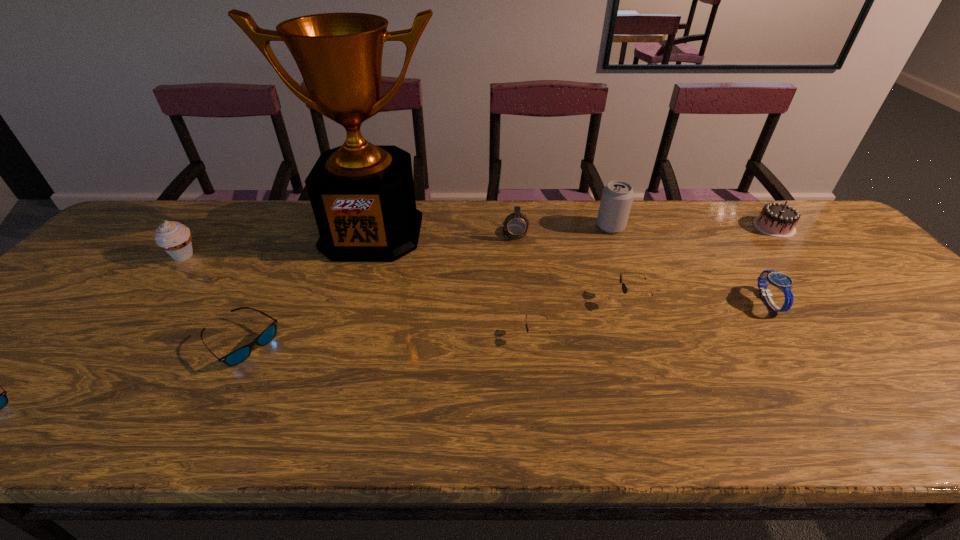
Find the location of `compass that is at the far edge`. compass that is at the far edge is located at coordinates coord(516,224).

This screenshot has height=540, width=960. In order to click on chocolate cake that is at the far edge in this screenshot , I will do `click(778, 220)`.

This screenshot has height=540, width=960. What are the coordinates of `object that is at the right edge` in the screenshot? It's located at (x=778, y=220).

Find the location of a particular element. The height and width of the screenshot is (540, 960). object located at the far right corner is located at coordinates (778, 220).

Where is `free point at the far edge`? Image resolution: width=960 pixels, height=540 pixels. free point at the far edge is located at coordinates (612, 235).

This screenshot has height=540, width=960. I want to click on free region at the near edge of the desktop, so click(x=39, y=429).

Locate an element on the screen. vacant area at the right edge of the desktop is located at coordinates (943, 395).

In order to click on vacant point located between the can and the left black sunglasses in this screenshot , I will do `click(573, 281)`.

I want to click on vacant space that's between the gold trophy cup and the right black sunglasses, so click(x=501, y=266).

Identify the location of vacant space that's between the tallest sunglasses and the gold trophy cup. (501, 266).